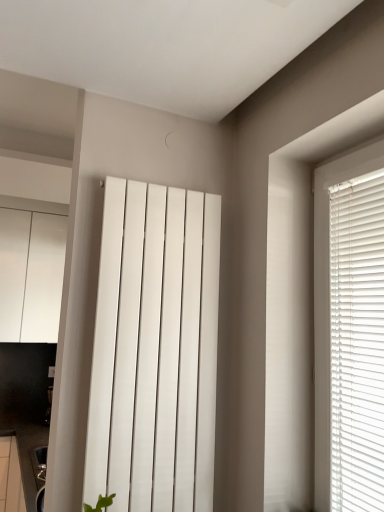
Question: Is white glossy cabinet at left taller or shorter than white smooth radiator at center?

Choices:
 (A) short
 (B) tall

Answer: (B)

Question: Is white glossy cabinet at left inside the boundaries of white smooth radiator at center, or outside?

Choices:
 (A) inside
 (B) outside

Answer: (B)

Question: Is point (49, 275) positioned closer to the camera than point (135, 384)?

Choices:
 (A) farther
 (B) closer

Answer: (A)

Question: Would you say white smooth radiator at center is to the left or to the right of white glossy cabinet at left in the picture?

Choices:
 (A) right
 (B) left

Answer: (A)

Question: Considering the positions of white smooth radiator at center and white glossy cabinet at left in the image, is white smooth radiator at center bigger or smaller than white glossy cabinet at left?

Choices:
 (A) big
 (B) small

Answer: (B)

Question: From the image's perspective, is white smooth radiator at center located above or below white glossy cabinet at left?

Choices:
 (A) below
 (B) above

Answer: (A)

Question: From a real-world perspective, is white smooth radiator at center physically located above or below white glossy cabinet at left?

Choices:
 (A) below
 (B) above

Answer: (A)